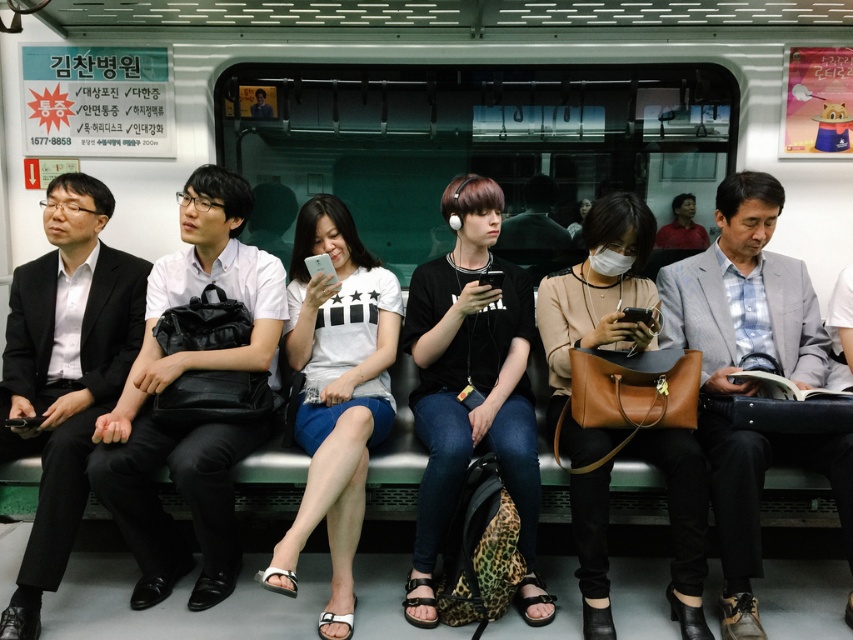
Question: Among these points, which one is farthest from the camera?

Choices:
 (A) (717, 216)
 (B) (77, 269)

Answer: (A)

Question: Can you confirm if gray fabric suit at right is positioned to the left of black suit at left?

Choices:
 (A) no
 (B) yes

Answer: (A)

Question: Can you confirm if matte black backpack at left is wider than matte black shirt at center?

Choices:
 (A) no
 (B) yes

Answer: (B)

Question: Does matte black backpack at left appear on the right side of black suit at left?

Choices:
 (A) no
 (B) yes

Answer: (B)

Question: Which point is closer to the camera taking this photo?

Choices:
 (A) (518, 381)
 (B) (730, 440)
 (C) (184, 234)

Answer: (B)

Question: Which is nearer to the matte black backpack at left?

Choices:
 (A) matte black shirt at center
 (B) gray fabric suit at right

Answer: (A)